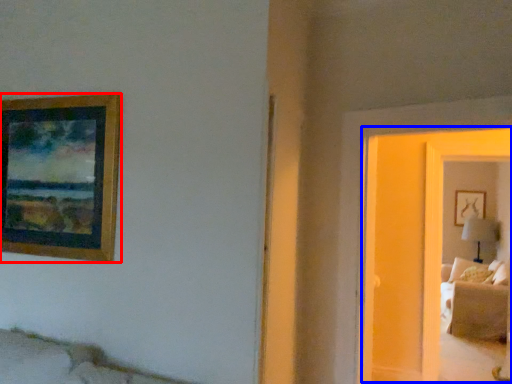
Question: Which point is closer to the camera, picture frame (highlighted by a red box) or glass door (highlighted by a blue box)?

Choices:
 (A) picture frame
 (B) glass door

Answer: (B)